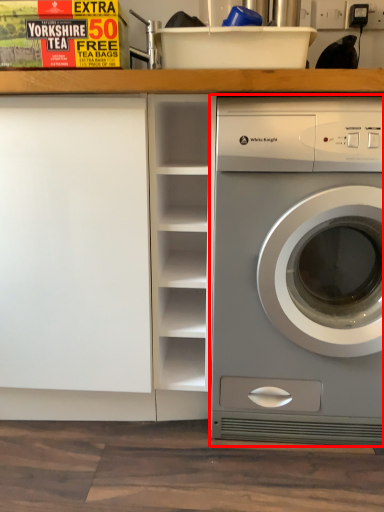
Question: Where is washing machine (annotated by the red box) located in relation to bookshelf in the image?

Choices:
 (A) right
 (B) left

Answer: (A)